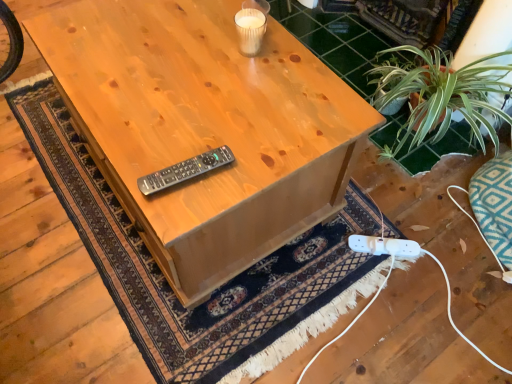
Question: Is white plastic plug at lower right to the right of natural wood table at center from the viewer's perspective?

Choices:
 (A) yes
 (B) no

Answer: (A)

Question: Is white plastic plug at lower right turned away from natural wood table at center?

Choices:
 (A) yes
 (B) no

Answer: (B)

Question: Considering the relative positions of white plastic plug at lower right and natural wood table at center in the image provided, is white plastic plug at lower right to the left of natural wood table at center from the viewer's perspective?

Choices:
 (A) yes
 (B) no

Answer: (B)

Question: Is white plastic plug at lower right further to the viewer compared to natural wood table at center?

Choices:
 (A) yes
 (B) no

Answer: (A)

Question: Is white plastic plug at lower right facing towards natural wood table at center?

Choices:
 (A) yes
 (B) no

Answer: (A)

Question: Choose the correct answer: Is natural wood table at center inside black plastic remote at center or outside it?

Choices:
 (A) outside
 (B) inside

Answer: (A)

Question: Is natural wood table at center wider or thinner than black plastic remote at center?

Choices:
 (A) wide
 (B) thin

Answer: (A)

Question: In the image, is natural wood table at center positioned in front of or behind black plastic remote at center?

Choices:
 (A) front
 (B) behind

Answer: (A)

Question: Is point (328, 180) positioned closer to the camera than point (206, 168)?

Choices:
 (A) closer
 (B) farther

Answer: (B)

Question: Considering the positions of black plastic remote at center and natural wood table at center in the image, is black plastic remote at center wider or thinner than natural wood table at center?

Choices:
 (A) wide
 (B) thin

Answer: (B)

Question: Relative to natural wood table at center, is black plastic remote at center in front or behind?

Choices:
 (A) behind
 (B) front

Answer: (A)

Question: From the image's perspective, relative to natural wood table at center, is black plastic remote at center above or below?

Choices:
 (A) below
 (B) above

Answer: (A)

Question: Choose the correct answer: Is black plastic remote at center inside natural wood table at center or outside it?

Choices:
 (A) inside
 (B) outside

Answer: (B)

Question: Looking at their shapes, would you say black plastic remote at center is wider or thinner than white plastic plug at lower right?

Choices:
 (A) thin
 (B) wide

Answer: (A)

Question: From a real-world perspective, is black plastic remote at center positioned above or below white plastic plug at lower right?

Choices:
 (A) above
 (B) below

Answer: (A)